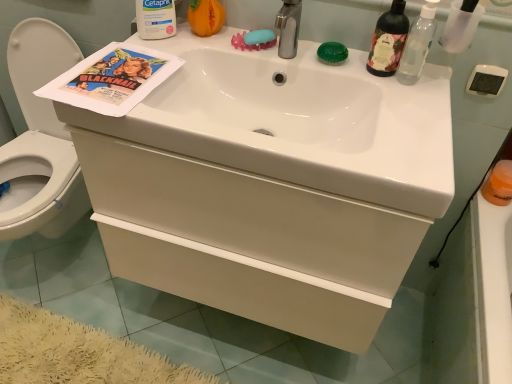
Where is `free space in front of green translucent soap at upper center, the second soap viewed from the left`? This screenshot has width=512, height=384. free space in front of green translucent soap at upper center, the second soap viewed from the left is located at coordinates (364, 79).